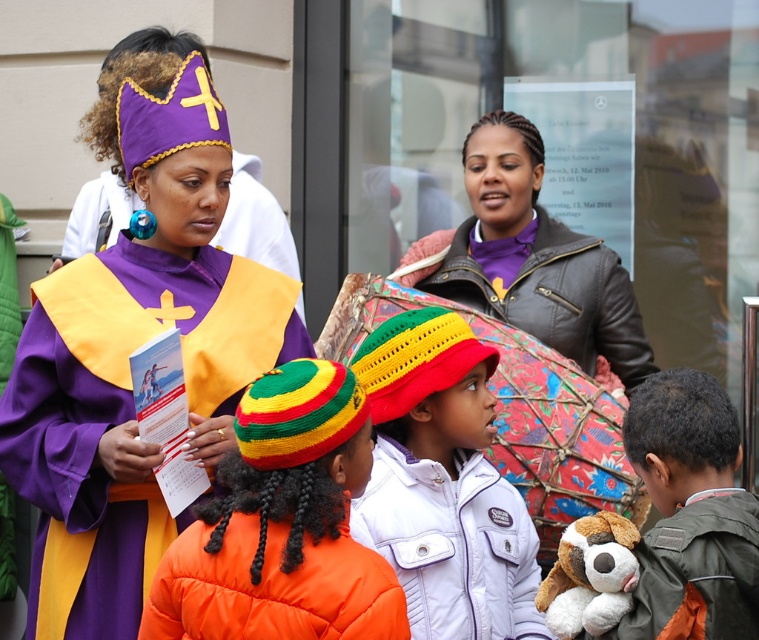
You are organizing a photo shoot and want to ensure that both the purple leather jacket at upper center and the soft plush toy at center are clearly visible in the final image. Based on their current positions, is there a risk that one might block the view of the other?

The purple leather jacket at upper center is positioned over the soft plush toy at center, so it may block the view of the soft plush toy at center. Adjust the jacket or toy to ensure both are visible.